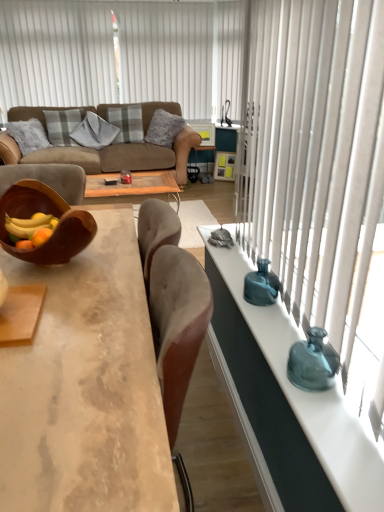
What do you see at coordinates (47, 213) in the screenshot? I see `brown wooden bowl at left` at bounding box center [47, 213].

The height and width of the screenshot is (512, 384). What are the coordinates of `brown wooden bowl at left` in the screenshot? It's located at (47, 213).

Locate an element on the screen. This screenshot has height=512, width=384. teal glass vase at right is located at coordinates (289, 403).

How much space does teal glass vase at right, marked as the 2th vase in a back-to-front arrangement, occupy vertically?

It is 5.50 inches.

This screenshot has width=384, height=512. What do you see at coordinates (312, 362) in the screenshot? I see `teal glass vase at right, arranged as the 1th vase when viewed from the front` at bounding box center [312, 362].

Where is `gray textured pillow at center, the second pillow positioned from the left`? gray textured pillow at center, the second pillow positioned from the left is located at coordinates (94, 132).

What is the approximate height of teal glass vase at right?

The height of teal glass vase at right is 3.31 feet.

In order to click on brown wooden bowl at left in this screenshot , I will do `click(47, 213)`.

Is teal glass vase at right, the 1th vase in the top-to-bottom sequence, wider or thinner than brown leather couch at upper left?

teal glass vase at right, the 1th vase in the top-to-bottom sequence, is thinner than brown leather couch at upper left.

Based on the photo, does teal glass vase at right, the second vase from the bottom, appear on the left side of brown leather couch at upper left?

In fact, teal glass vase at right, the second vase from the bottom, is to the right of brown leather couch at upper left.

Is teal glass vase at right, the first vase when ordered from back to front, situated inside brown leather couch at upper left or outside?

teal glass vase at right, the first vase when ordered from back to front, is spatially situated outside brown leather couch at upper left.

From a real-world perspective, between teal glass vase at right, the second vase from the bottom, and brown leather couch at upper left, who is vertically higher?

In real-world perspective, teal glass vase at right, the second vase from the bottom, is above.

I want to click on pillow that is the 2nd object above the plaid fabric pillow at upper left, the fourth pillow when ordered from right to left (from a real-world perspective), so click(x=127, y=123).

Considering the sizes of objects plaid fabric pillow at center, which is the 2th pillow in right-to-left order, and plaid fabric pillow at upper left, which is the 1th pillow from left to right, in the image provided, who is shorter, plaid fabric pillow at center, which is the 2th pillow in right-to-left order, or plaid fabric pillow at upper left, which is the 1th pillow from left to right,?

plaid fabric pillow at upper left, which is the 1th pillow from left to right.

Is plaid fabric pillow at center, which is the 2th pillow in right-to-left order, smaller than plaid fabric pillow at upper left, which is the 1th pillow from left to right?

No.

Which point is more distant from viewer, (137, 127) or (69, 112)?

Point (69, 112)

Between teal glass vase at right and teal glass vase at right, the second vase from the bottom, which one has larger size?

With larger size is teal glass vase at right.

Which object is closer to the camera taking this photo, teal glass vase at right or teal glass vase at right, the first vase when ordered from back to front?

teal glass vase at right.

Who is shorter, teal glass vase at right or teal glass vase at right, the second vase from the bottom?

teal glass vase at right, the second vase from the bottom.

Can you tell me how much teal glass vase at right and teal glass vase at right, the first vase when ordered from back to front, differ in facing direction?

They differ by 0.563 degrees in their facing directions.

Based on the photo, is teal glass vase at right, arranged as the 1th vase when viewed from the front, bigger or smaller than plaid fabric pillow at upper left, which is the 1th pillow from left to right?

Considering their sizes, teal glass vase at right, arranged as the 1th vase when viewed from the front, takes up less space than plaid fabric pillow at upper left, which is the 1th pillow from left to right.

Between teal glass vase at right, placed as the 1th vase when sorted from bottom to top, and plaid fabric pillow at upper left, which is the 1th pillow from left to right, which one has more height?

Standing taller between the two is plaid fabric pillow at upper left, which is the 1th pillow from left to right.

Can we say teal glass vase at right, placed as the 2th vase when sorted from top to bottom, lies outside plaid fabric pillow at upper left, which is the 1th pillow from left to right?

Yes, teal glass vase at right, placed as the 2th vase when sorted from top to bottom, is located beyond the bounds of plaid fabric pillow at upper left, which is the 1th pillow from left to right.

Which object is further away from the camera taking this photo, teal glass vase at right, marked as the 2th vase in a back-to-front arrangement, or plaid fabric pillow at upper left, the fourth pillow when ordered from right to left?

plaid fabric pillow at upper left, the fourth pillow when ordered from right to left, is further from the camera.

Would you consider brown leather couch at upper left to be distant from plaid fabric pillow at center, which is the 2th pillow in right-to-left order?

brown leather couch at upper left is near plaid fabric pillow at center, which is the 2th pillow in right-to-left order, not far away.

Is brown leather couch at upper left positioned beyond the bounds of plaid fabric pillow at center, placed as the third pillow when sorted from left to right?

That's correct, brown leather couch at upper left is outside of plaid fabric pillow at center, placed as the third pillow when sorted from left to right.

Between brown leather couch at upper left and plaid fabric pillow at center, placed as the third pillow when sorted from left to right, which one appears on the left side from the viewer's perspective?

From the viewer's perspective, brown leather couch at upper left appears more on the left side.

Considering the relative sizes of teal glass vase at right, arranged as the 1th vase when viewed from the front, and concrete textured coffee table at center in the image provided, is teal glass vase at right, arranged as the 1th vase when viewed from the front, smaller than concrete textured coffee table at center?

Yes.

Considering the relative positions of teal glass vase at right, placed as the 2th vase when sorted from top to bottom, and concrete textured coffee table at center in the image provided, is teal glass vase at right, placed as the 2th vase when sorted from top to bottom, behind concrete textured coffee table at center?

Yes, teal glass vase at right, placed as the 2th vase when sorted from top to bottom, is behind concrete textured coffee table at center.

Find the location of a particular element. the 2nd vase directly above the concrete textured coffee table at center (from a real-world perspective) is located at coordinates (312, 362).

Are gray textured pillow at center, the 4th pillow in the left-to-right sequence, and teal glass vase at right, the first vase when ordered from back to front, far apart?

Absolutely, gray textured pillow at center, the 4th pillow in the left-to-right sequence, is distant from teal glass vase at right, the first vase when ordered from back to front.

How many degrees apart are the facing directions of gray textured pillow at center, the first pillow in the right-to-left sequence, and teal glass vase at right, the second vase from the bottom?

The facing directions of gray textured pillow at center, the first pillow in the right-to-left sequence, and teal glass vase at right, the second vase from the bottom, are 36.6 degrees apart.

From the image's perspective, between gray textured pillow at center, the 4th pillow in the left-to-right sequence, and teal glass vase at right, the first vase when ordered from back to front, which one is located above?

gray textured pillow at center, the 4th pillow in the left-to-right sequence, appears higher in the image.

Is gray textured pillow at center, the 4th pillow in the left-to-right sequence, further to the viewer compared to teal glass vase at right, the second vase from the bottom?

Yes, it is.

Find the location of a particular element. studio couch behind the teal glass vase at right, the 1th vase in the top-to-bottom sequence is located at coordinates (86, 158).

Find the location of `the 2nd pillow counting from the right side of the plaid fabric pillow at upper left, which is the 1th pillow from left to right`. the 2nd pillow counting from the right side of the plaid fabric pillow at upper left, which is the 1th pillow from left to right is located at coordinates (127, 123).

Considering their positions, is plaid fabric pillow at upper left, which is the 1th pillow from left to right, positioned closer to gray textured pillow at center, the second pillow positioned from the left, than plaid fabric pillow at center, placed as the third pillow when sorted from left to right?

Among the two, plaid fabric pillow at upper left, which is the 1th pillow from left to right, is located nearer to gray textured pillow at center, the second pillow positioned from the left.

Considering their positions, is teal glass vase at right positioned closer to concrete textured coffee table at center than plaid fabric pillow at center, placed as the third pillow when sorted from left to right?

teal glass vase at right lies closer to concrete textured coffee table at center than the other object.

In the scene shown: Considering their positions, is plaid fabric pillow at upper left, the fourth pillow when ordered from right to left, positioned further to white vertical blinds at upper left than concrete textured coffee table at center?

concrete textured coffee table at center lies further to white vertical blinds at upper left than the other object.

Estimate the real-world distances between objects in this image. Which object is closer to concrete textured coffee table at center, gray textured pillow at center, the 4th pillow in the left-to-right sequence, or gray textured pillow at center, acting as the third pillow starting from the right?

gray textured pillow at center, acting as the third pillow starting from the right, is closer to concrete textured coffee table at center.

From the image, which object appears to be nearer to plaid fabric pillow at center, placed as the third pillow when sorted from left to right, teal glass vase at right, the 1th vase in the top-to-bottom sequence, or gray textured pillow at center, the first pillow in the right-to-left sequence?

Among the two, gray textured pillow at center, the first pillow in the right-to-left sequence, is located nearer to plaid fabric pillow at center, placed as the third pillow when sorted from left to right.

When comparing their distances from brown wooden bowl at left, does teal glass vase at right, placed as the second vase when sorted from front to back, or plaid fabric pillow at center, placed as the third pillow when sorted from left to right, seem closer?

teal glass vase at right, placed as the second vase when sorted from front to back.

Based on their spatial positions, is gray textured pillow at center, the 4th pillow in the left-to-right sequence, or teal glass vase at right, placed as the 2th vase when sorted from top to bottom, closer to brown wooden bowl at left?

teal glass vase at right, placed as the 2th vase when sorted from top to bottom, is closer to brown wooden bowl at left.

Which object lies further to the anchor point teal glass vase at right, the second vase from the bottom, gray textured pillow at center, the first pillow in the right-to-left sequence, or gray textured pillow at center, acting as the third pillow starting from the right?

gray textured pillow at center, acting as the third pillow starting from the right, lies further to teal glass vase at right, the second vase from the bottom, than the other object.

Locate an element on the screen. The height and width of the screenshot is (512, 384). pillow between brown wooden bowl at left and plaid fabric pillow at upper left, the fourth pillow when ordered from right to left, along the z-axis is located at coordinates (164, 128).

Identify the location of bowl between concrete textured coffee table at center and gray textured pillow at center, the second pillow positioned from the left, in the front-back direction. (47, 213).

The height and width of the screenshot is (512, 384). Identify the location of blind between teal glass vase at right and gray textured pillow at center, acting as the third pillow starting from the right, from front to back. (121, 54).

Find the location of a particular element. The height and width of the screenshot is (512, 384). table between concrete textured coffee table at center and teal glass vase at right in the horizontal direction is located at coordinates (289, 403).